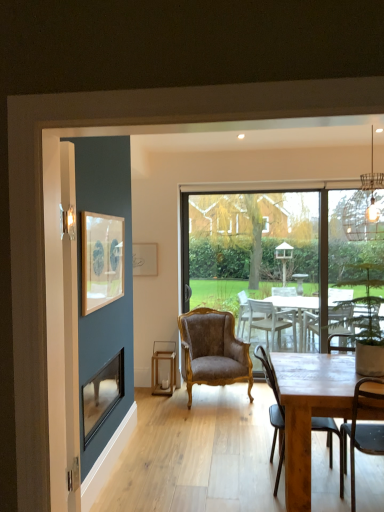
Question: Should I look upward or downward to see metallic black chair at lower right, the 3th chair when ordered from back to front?

Choices:
 (A) up
 (B) down

Answer: (B)

Question: Is transparent glass window at center taller than metallic wire cage at upper right?

Choices:
 (A) no
 (B) yes

Answer: (B)

Question: Can you confirm if transparent glass window at center is smaller than metallic wire cage at upper right?

Choices:
 (A) no
 (B) yes

Answer: (A)

Question: Is transparent glass window at center not near metallic wire cage at upper right?

Choices:
 (A) no
 (B) yes

Answer: (B)

Question: From a real-world perspective, does transparent glass window at center stand above metallic wire cage at upper right?

Choices:
 (A) yes
 (B) no

Answer: (B)

Question: From a real-world perspective, is transparent glass window at center below metallic wire cage at upper right?

Choices:
 (A) no
 (B) yes

Answer: (B)

Question: Is transparent glass window at center positioned before metallic wire cage at upper right?

Choices:
 (A) no
 (B) yes

Answer: (A)

Question: From the image's perspective, is brown velvet armchair at center, which appears as the 1th chair when viewed from the back, located beneath wooden framed artwork at upper left, acting as the first picture frame starting from the front?

Choices:
 (A) no
 (B) yes

Answer: (B)

Question: Does brown velvet armchair at center, the 3th chair from the front, have a greater height compared to wooden framed artwork at upper left, acting as the first picture frame starting from the front?

Choices:
 (A) no
 (B) yes

Answer: (B)

Question: Is brown velvet armchair at center, the 3th chair from the front, closer to camera compared to wooden framed artwork at upper left, acting as the first picture frame starting from the front?

Choices:
 (A) no
 (B) yes

Answer: (A)

Question: Considering the relative positions of brown velvet armchair at center, the 3th chair from the front, and wooden framed artwork at upper left, acting as the second picture frame starting from the back, in the image provided, is brown velvet armchair at center, the 3th chair from the front, to the right of wooden framed artwork at upper left, acting as the second picture frame starting from the back, from the viewer's perspective?

Choices:
 (A) yes
 (B) no

Answer: (A)

Question: Does brown velvet armchair at center, which appears as the 1th chair when viewed from the back, turn towards wooden framed artwork at upper left, acting as the second picture frame starting from the back?

Choices:
 (A) yes
 (B) no

Answer: (B)

Question: Is brown velvet armchair at center, the 3th chair from the front, positioned with its back to wooden framed artwork at upper left, acting as the second picture frame starting from the back?

Choices:
 (A) no
 (B) yes

Answer: (A)

Question: Could you tell me if brown velvet armchair at center, which appears as the 1th chair when viewed from the back, is turned towards transparent glass window at center?

Choices:
 (A) yes
 (B) no

Answer: (B)